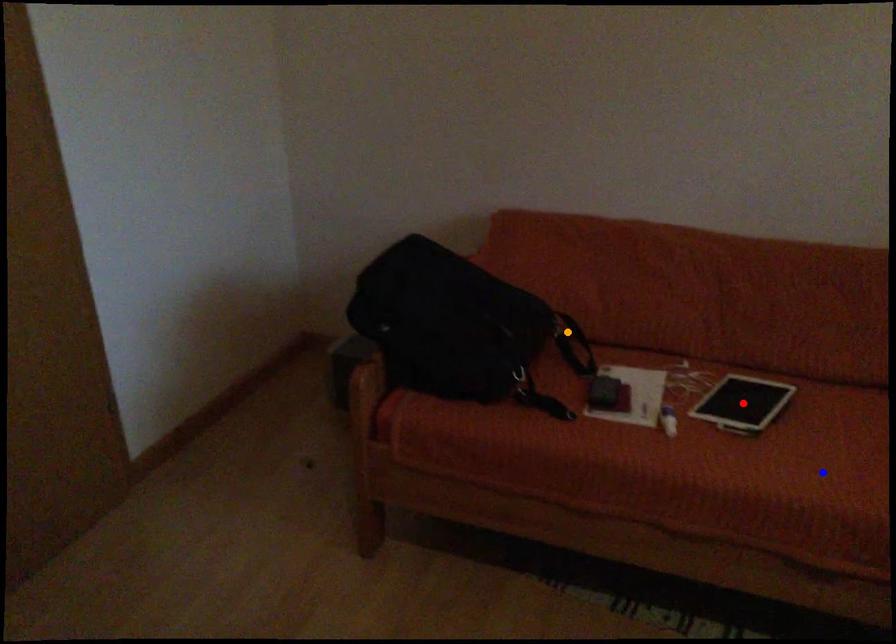
Order these from nearest to farthest:
A) red point
B) orange point
C) blue point

blue point, red point, orange point